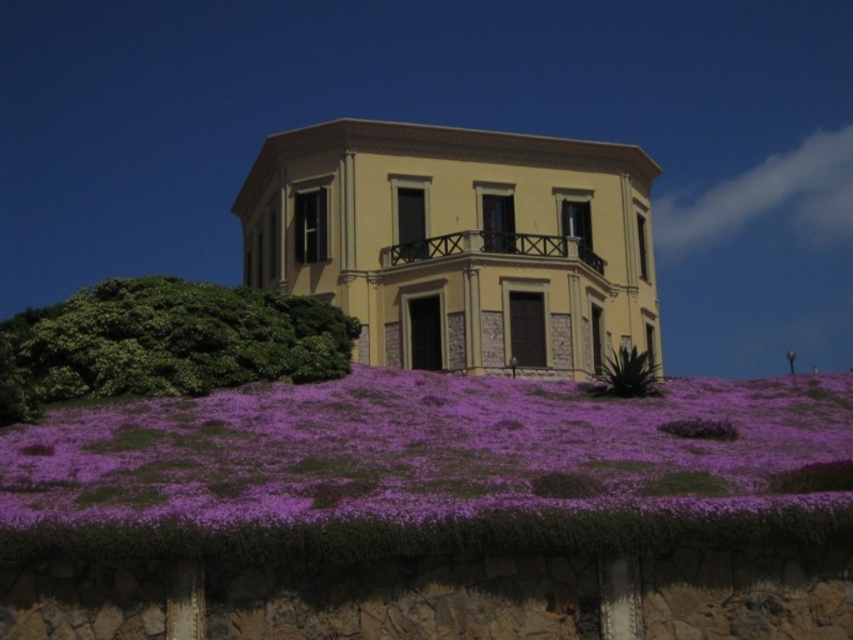
Is the position of purple soft grass at lower center less distant than that of green spiky plant at lower right?

Yes, purple soft grass at lower center is closer to the viewer.

Does point (426, 493) come in front of point (641, 390)?

Yes, point (426, 493) is closer to viewer.

At what (x,y) coordinates should I click in order to perform the action: click on purple soft grass at lower center. Please return your answer as a coordinate pair (x, y). Looking at the image, I should click on (421, 449).